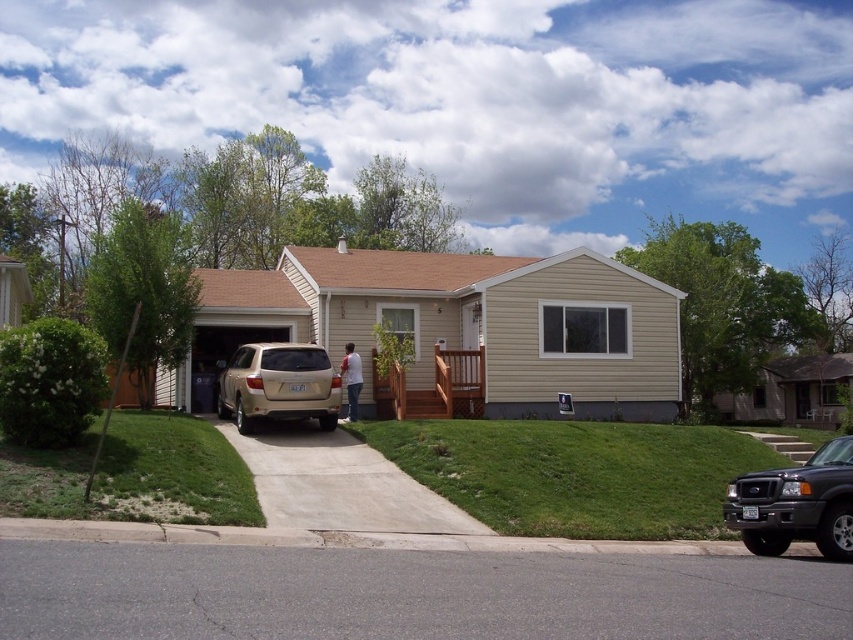
You are a delivery person trying to park your van near the driveway. You see the asphalt at lower center and the shiny black suv at lower right. Which surface can you park on?

The asphalt at lower center is located below the shiny black suv at lower right, meaning it is the surface beneath the SUV. Since the SUV is parked on the asphalt, you can park on the asphalt at lower center as long as it is available and not occupied.

You are a delivery person trying to park your van next to the shiny black suv at lower right. The van requires a space larger than the concrete at center. Can you park there?

The concrete at center is smaller than the shiny black suv at lower right, so the van cannot park there since the space is smaller than the SUV and the van needs a larger area.

You are a delivery person trying to park your van in the driveway. You see the concrete at center and the shiny black suv at lower right. Which object is closer to the entrance of the house?

The concrete at center is closer to the entrance of the house because the shiny black suv at lower right is behind it.